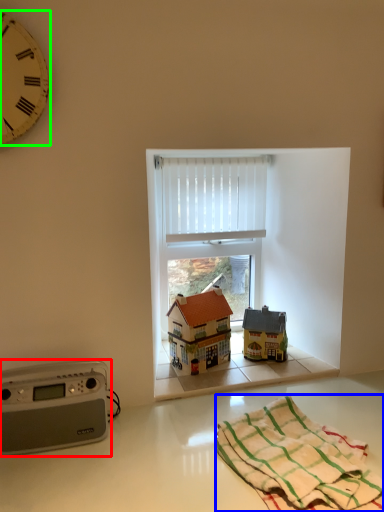
Question: Which object is positioned closest to stereo (highlighted by a red box)? Select from blanket (highlighted by a blue box) and clock (highlighted by a green box).

Choices:
 (A) blanket
 (B) clock

Answer: (A)